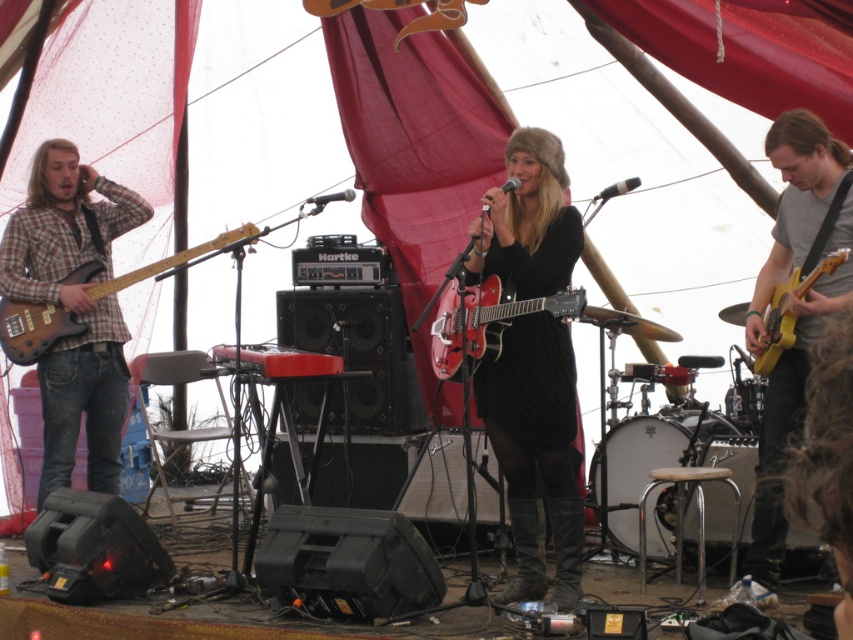
You are a photographer at the live music performance. You want to take a photo of the black fur hat at center and the matte yellow guitar at right. Can you position yourself so that both are fully visible without any part of them being blocked by other objects in the scene?

→ The matte yellow guitar at right is behind the black fur hat at center, so positioning yourself to capture both fully visible without obstruction may be challenging. Adjust your angle to ensure the matte yellow guitar at right isn not hidden behind the black fur hat at center.

You are a photographer standing at the center of the stage. You want to take a photo that includes both the point at coordinates point (93,202) and point (18,349). Which point should you focus on first to ensure both are in focus?

You should focus on point (93,202) first because it is closer to you than point (18,349), ensuring both points are within the depth of field.